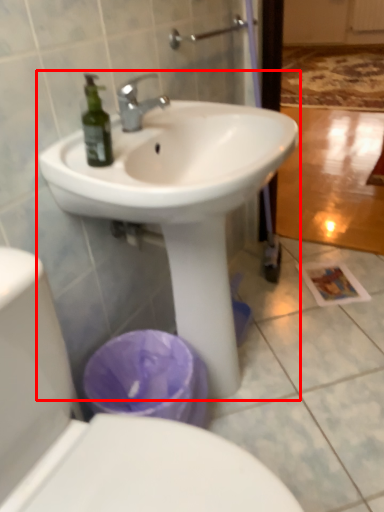
Question: From the image's perspective, where is sink (annotated by the red box) located in relation to toilet in the image?

Choices:
 (A) above
 (B) below

Answer: (A)